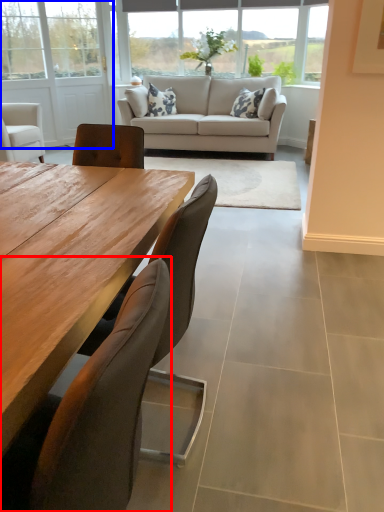
Question: Which of the following is the farthest to the observer, chair (highlighted by a red box) or screen door (highlighted by a blue box)?

Choices:
 (A) chair
 (B) screen door

Answer: (B)